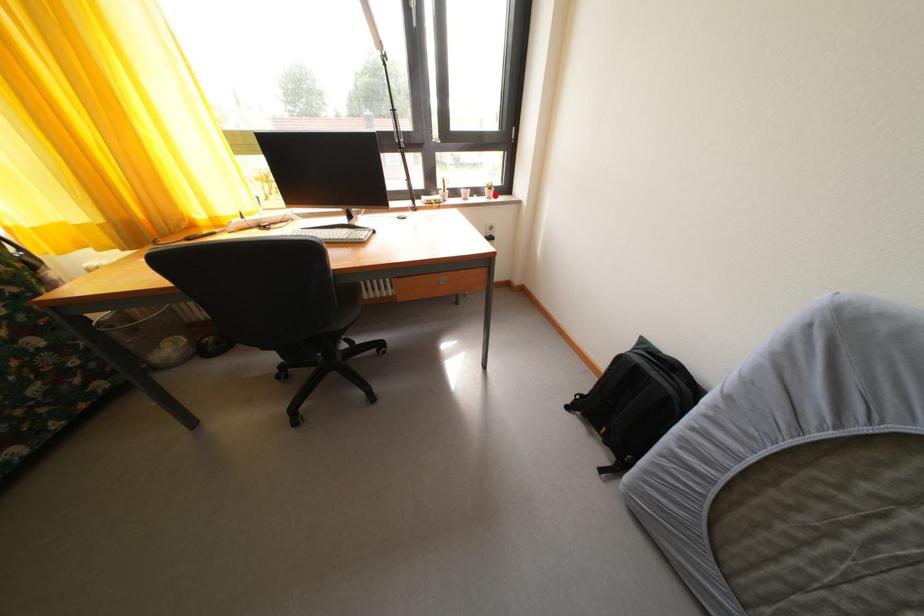
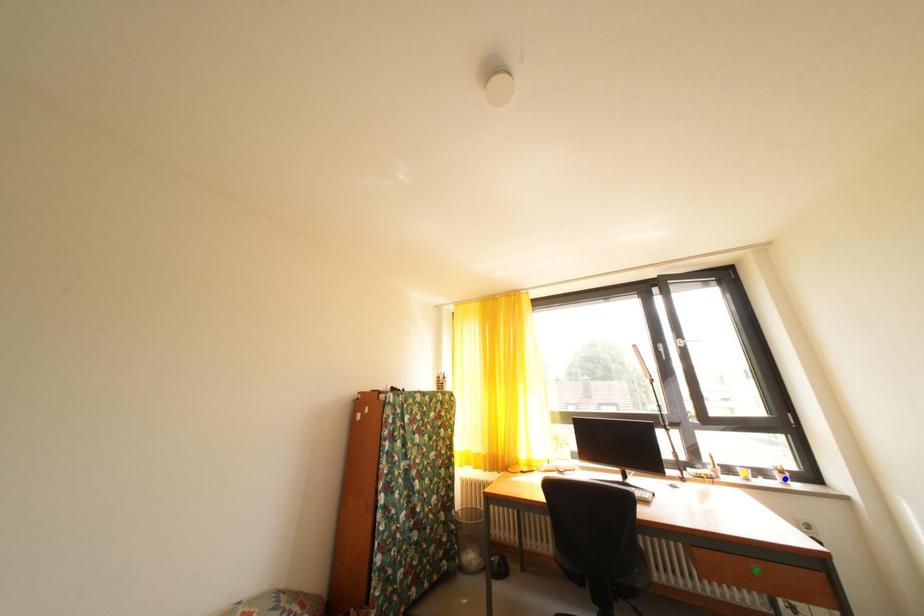
Question: I am providing you with two images of the same scene from different viewpoints. A red point is marked on the first image. You are given multiple points on the second image. Which point in image 2 is actually the same real-world point as the red point in image 1?

Choices:
 (A) blue point
 (B) green point
 (C) yellow point

Answer: (A)